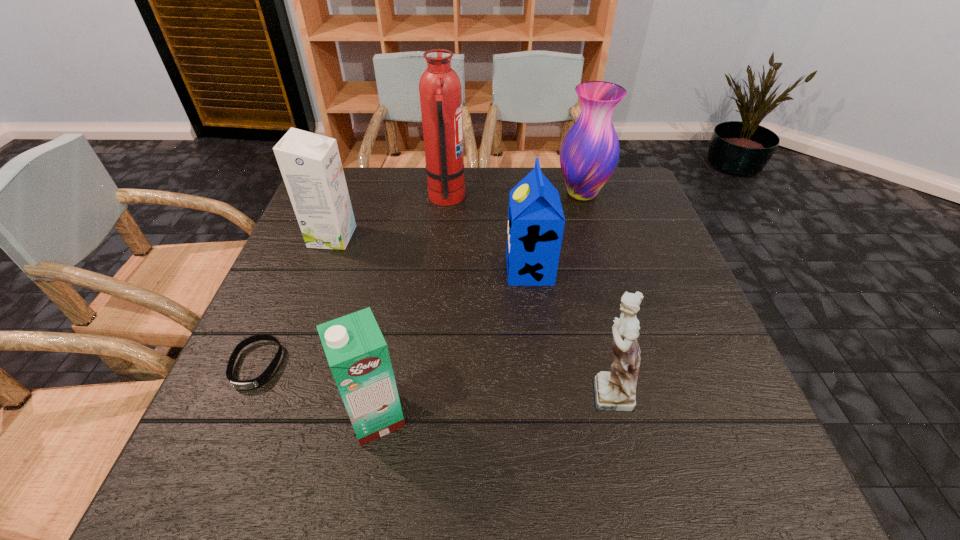
Identify the location of free location that satisfies the following two spatial constraints: 1. on the back side of the third farthest object; 2. on the left side of the vase. The height and width of the screenshot is (540, 960). (348, 193).